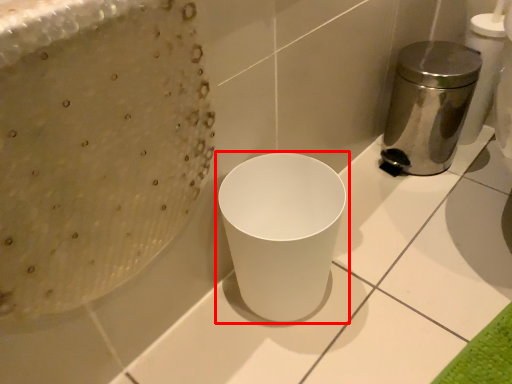
Question: From the image's perspective, what is the correct spatial relationship of waste container (annotated by the red box) in relation to appliance?

Choices:
 (A) above
 (B) below

Answer: (B)